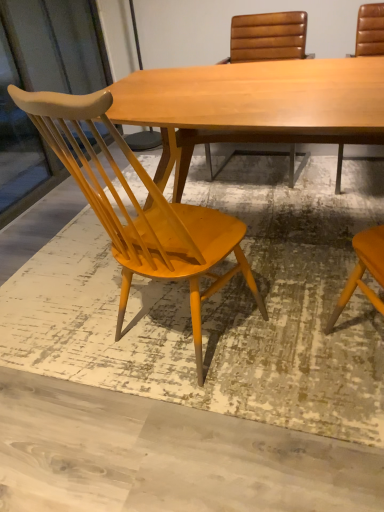
Question: Is leather at right, which is the 1th chair from right to left, directly adjacent to leather-like brown chair at upper center, which ranks as the second chair in left-to-right order?

Choices:
 (A) yes
 (B) no

Answer: (B)

Question: Can you confirm if leather at right, the third chair when ordered from left to right, is taller than leather-like brown chair at upper center, which ranks as the second chair in left-to-right order?

Choices:
 (A) no
 (B) yes

Answer: (B)

Question: Is the position of leather at right, which is the 1th chair from right to left, more distant than that of leather-like brown chair at upper center, which ranks as the second chair in left-to-right order?

Choices:
 (A) yes
 (B) no

Answer: (B)

Question: Is leather-like brown chair at upper center, which ranks as the second chair in left-to-right order, located within leather at right, the third chair when ordered from left to right?

Choices:
 (A) yes
 (B) no

Answer: (B)

Question: Does leather at right, the third chair when ordered from left to right, come in front of leather-like brown chair at upper center, which ranks as the second chair in left-to-right order?

Choices:
 (A) yes
 (B) no

Answer: (A)

Question: From a real-world perspective, is leather at right, which is the 1th chair from right to left, positioned over leather-like brown chair at upper center, which ranks as the second chair in left-to-right order, based on gravity?

Choices:
 (A) yes
 (B) no

Answer: (A)

Question: Is leather at right, the third chair when ordered from left to right, not inside matte wood screen door at left?

Choices:
 (A) no
 (B) yes

Answer: (B)

Question: Is leather at right, the third chair when ordered from left to right, oriented towards matte wood screen door at left?

Choices:
 (A) no
 (B) yes

Answer: (A)

Question: Is leather at right, the third chair when ordered from left to right, next to matte wood screen door at left?

Choices:
 (A) no
 (B) yes

Answer: (A)

Question: Considering the relative sizes of leather at right, which is the 1th chair from right to left, and matte wood screen door at left in the image provided, is leather at right, which is the 1th chair from right to left, bigger than matte wood screen door at left?

Choices:
 (A) yes
 (B) no

Answer: (B)

Question: Is leather at right, the third chair when ordered from left to right, facing away from matte wood screen door at left?

Choices:
 (A) no
 (B) yes

Answer: (A)

Question: Can you confirm if leather at right, which is the 1th chair from right to left, is thinner than matte wood screen door at left?

Choices:
 (A) yes
 (B) no

Answer: (B)

Question: Is matte yellow wood chair at left, marked as the 1th chair in a left-to-right arrangement, further to the viewer compared to leather at right, the third chair when ordered from left to right?

Choices:
 (A) no
 (B) yes

Answer: (A)